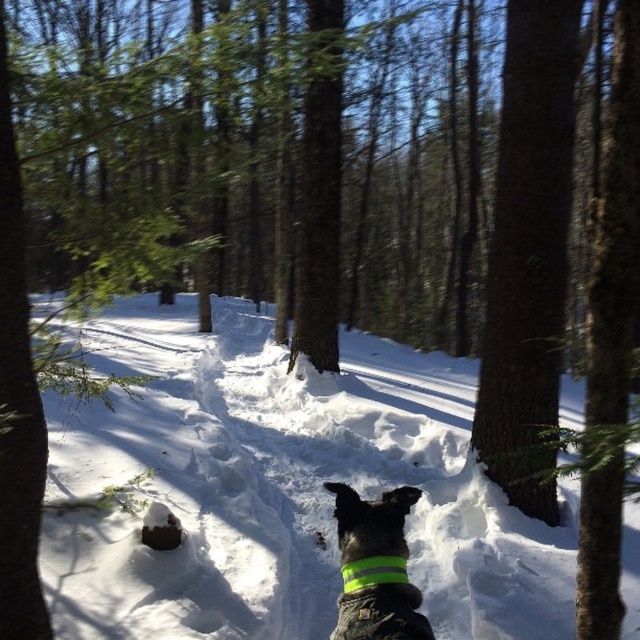
Describe the element at coordinates (284, 488) in the screenshot. I see `white fluffy snow at center` at that location.

What do you see at coordinates (284, 488) in the screenshot?
I see `white fluffy snow at center` at bounding box center [284, 488].

This screenshot has height=640, width=640. Identify the location of white fluffy snow at center. (284, 488).

Does reflective fabric dog at center appear on the left side of green reflective band at center?

Incorrect, reflective fabric dog at center is not on the left side of green reflective band at center.

Can you confirm if reflective fabric dog at center is smaller than green reflective band at center?

Actually, reflective fabric dog at center might be larger than green reflective band at center.

Is point (346, 600) closer to camera compared to point (346, 568)?

Yes, point (346, 600) is closer to viewer.

The image size is (640, 640). I want to click on reflective fabric dog at center, so click(x=376, y=566).

Can you confirm if white fluffy snow at center is shorter than dark brown bark at center right?

Incorrect, white fluffy snow at center's height does not fall short of dark brown bark at center right's.

Which is below, white fluffy snow at center or dark brown bark at center right?

white fluffy snow at center

Image resolution: width=640 pixels, height=640 pixels. I want to click on white fluffy snow at center, so click(x=284, y=488).